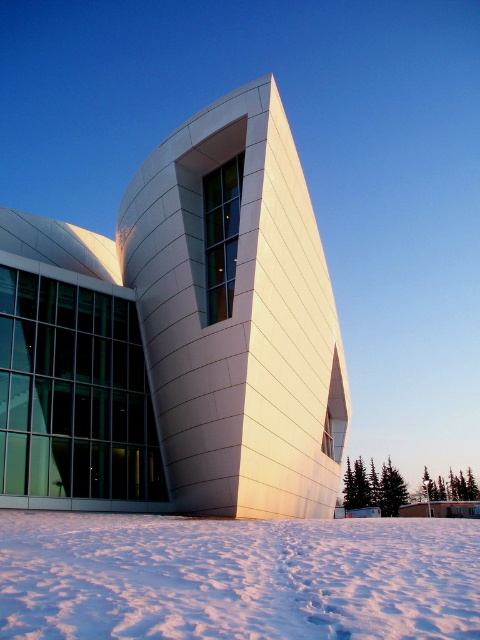
Is point (120, 260) positioned in front of point (145, 516)?

No.

Does white smooth building at center appear on the left side of white powdery snow at lower center?

No, white smooth building at center is not to the left of white powdery snow at lower center.

At what (x,y) coordinates should I click in order to perform the action: click on white smooth building at center. Please return your answer as a coordinate pair (x, y). Image resolution: width=480 pixels, height=640 pixels. Looking at the image, I should click on (179, 337).